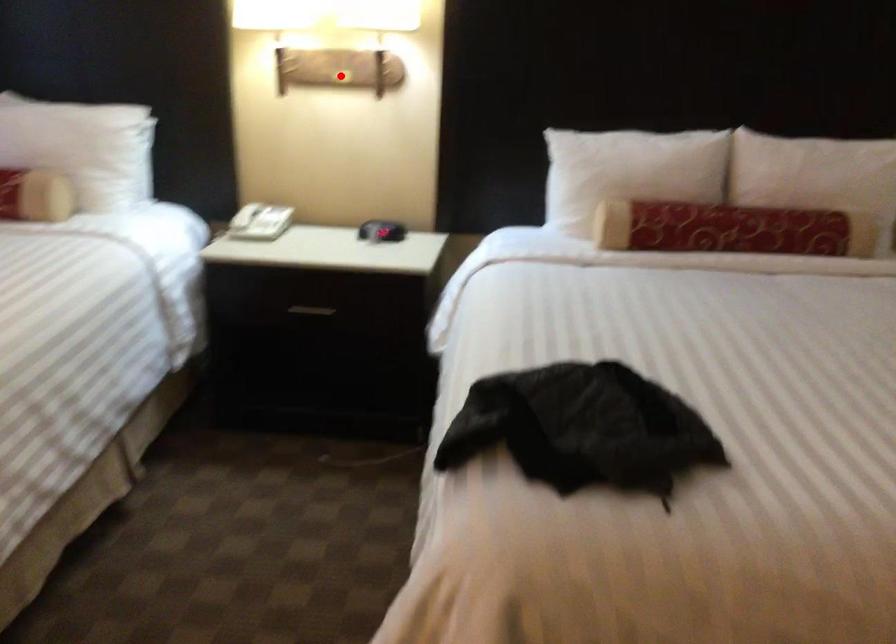
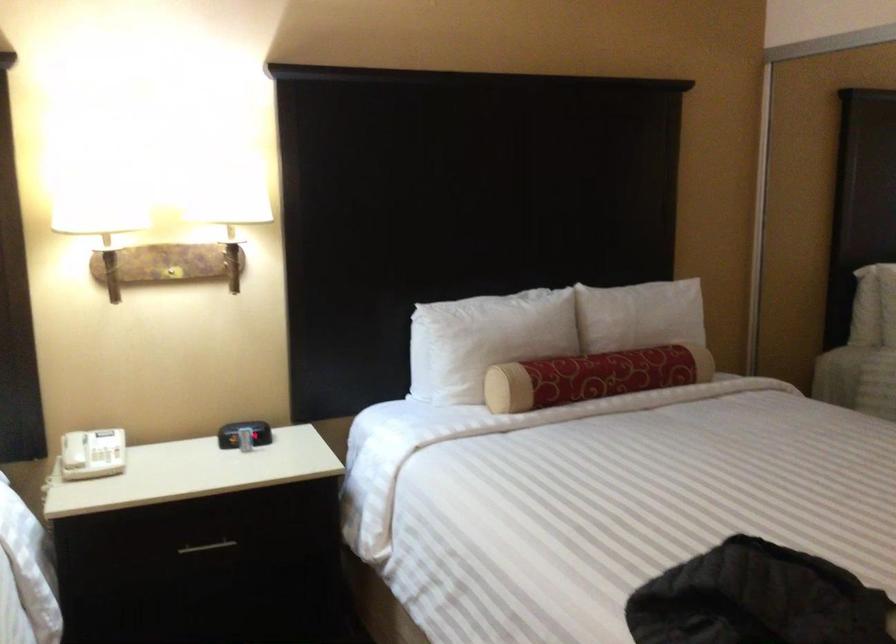
Question: I am providing you with two images of the same scene from different viewpoints. In image1, a red point is highlighted. Considering the same 3D point in image2, which of the following is correct?

Choices:
 (A) It is closer
 (B) It is farther

Answer: (A)